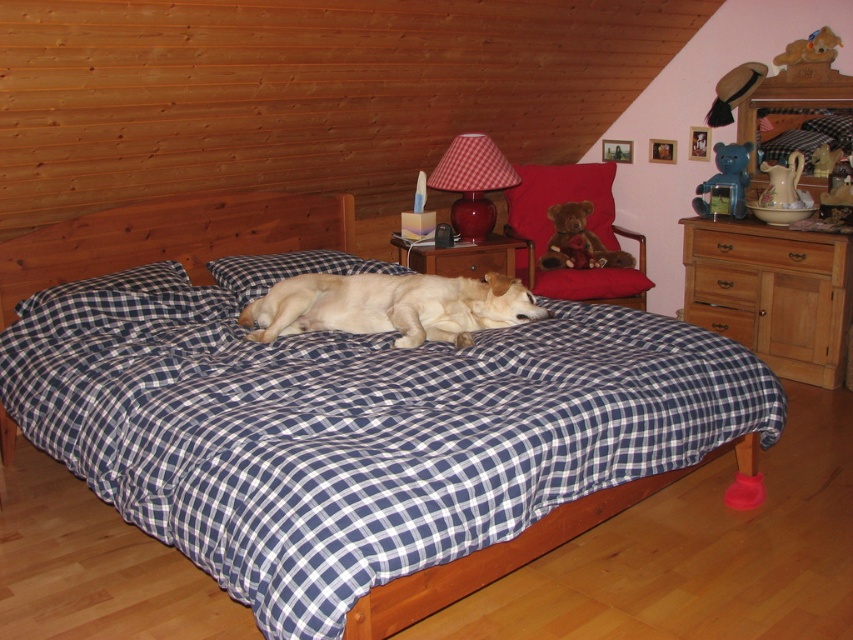
You are a guest in this bedroom and want to place a small book on the nearest available surface. The red plush bear at upper right and the checkered fabric pillow at left are both on surfaces. Which surface should you choose?

The red plush bear at upper right is positioned on the right side of checkered fabric pillow at left. Since the checkered fabric pillow at left is on the left, it is closer to you as a guest standing in the room. Place the book on the checkered fabric pillow at left.

You are standing in the bedroom and want to place a new red plush bear at upper right. Where should you place it?

You should place the red plush bear at upper right at point (560, 198).